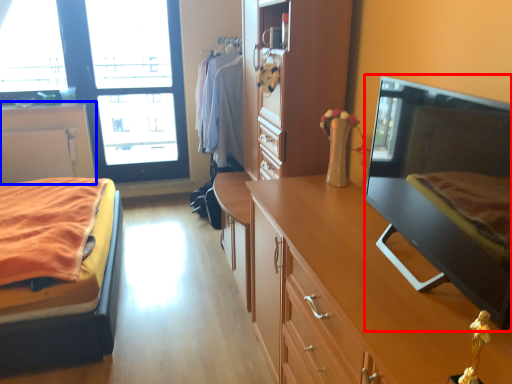
Question: Which point is closer to the camera, flat (highlighted by a red box) or cabinetry (highlighted by a blue box)?

Choices:
 (A) flat
 (B) cabinetry

Answer: (A)